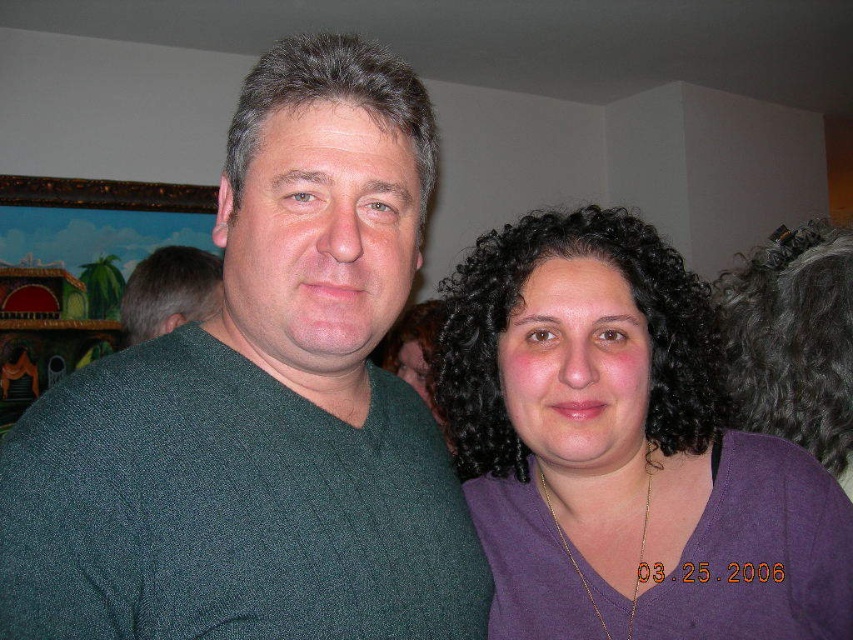
Question: Is dark green sweater at center bigger than purple matte shirt at center?

Choices:
 (A) yes
 (B) no

Answer: (B)

Question: Based on their relative distances, which object is farther from the green knit sweater at center?

Choices:
 (A) dark green sweater at center
 (B) purple matte shirt at center

Answer: (A)

Question: Estimate the real-world distances between objects in this image. Which object is farther from the purple matte shirt at center?

Choices:
 (A) green knit sweater at center
 (B) dark green sweater at center

Answer: (A)

Question: Which object is positioned farthest from the green knit sweater at center?

Choices:
 (A) dark green sweater at center
 (B) purple matte shirt at center

Answer: (A)

Question: Is purple matte shirt at center above green knit sweater at center?

Choices:
 (A) yes
 (B) no

Answer: (B)

Question: Where is purple matte shirt at center located in relation to green knit sweater at center in the image?

Choices:
 (A) below
 (B) above

Answer: (A)